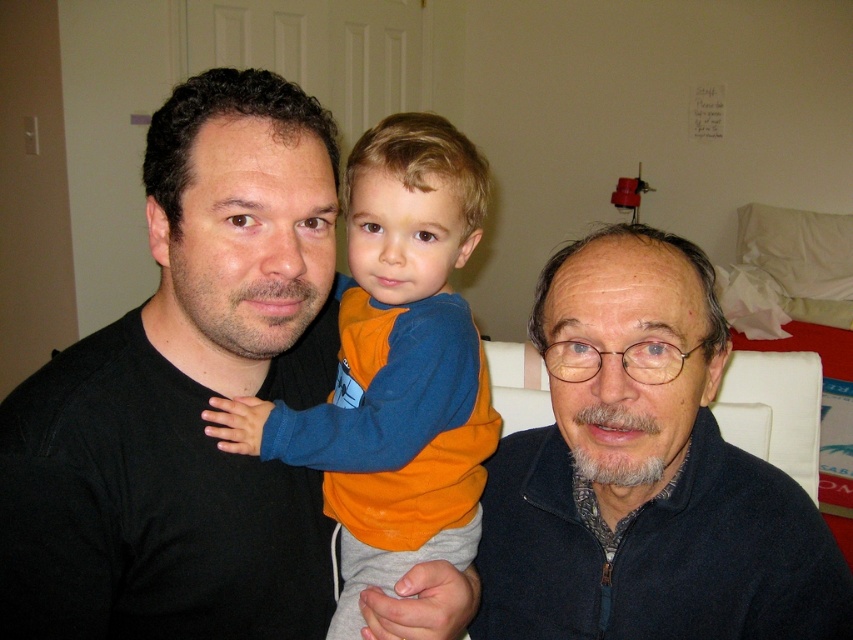
In the scene shown: You are helping to organize a clothing donation drive. You have two fleece items to place into boxes. The dark blue fleece at center and the orange fleece at center. The boxes can only hold items that are smaller than 1 meter in length. Can both items fit into the boxes?

The dark blue fleece at center has a larger size compared to orange fleece at center. However, since both are fleece items and the boxes can hold items smaller than 1 meter in length, both can fit as their sizes are likely under the limit unless specified otherwise.

You are a photographer setting up a photo shoot in the living room. You need to position two fleece blankets, the dark blue fleece at center and the orange fleece at center, such that one is visible in the foreground and the other in the background. Based on the scene described, which fleece is currently positioned in the foreground?

The dark blue fleece at center is in front of the orange fleece at center, so the dark blue fleece at center is positioned in the foreground.